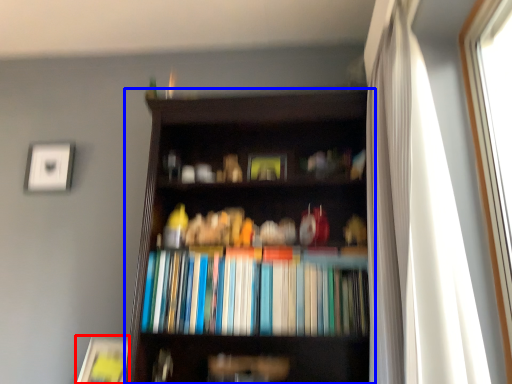
Question: Which of the following is the closest to the observer, paperback book (highlighted by a red box) or bookcase (highlighted by a blue box)?

Choices:
 (A) paperback book
 (B) bookcase

Answer: (B)